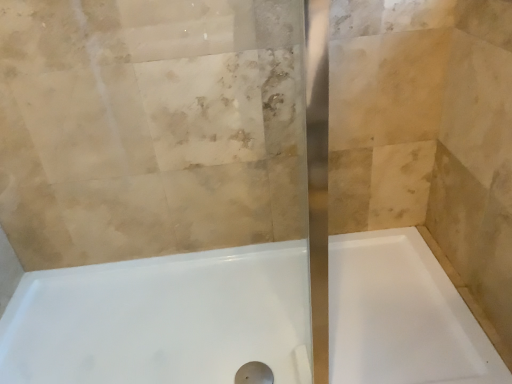
At what (x,y) coordinates should I click in order to perform the action: click on vacant region above white glossy bathtub at lower center (from a real-world perspective). Please return your answer as a coordinate pair (x, y). The width and height of the screenshot is (512, 384). Looking at the image, I should click on (223, 319).